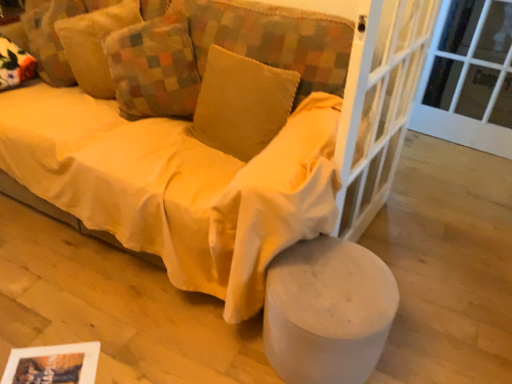
The height and width of the screenshot is (384, 512). In order to click on vacant area that is situated to the right of white fabric stool at lower right in this screenshot , I will do click(x=411, y=345).